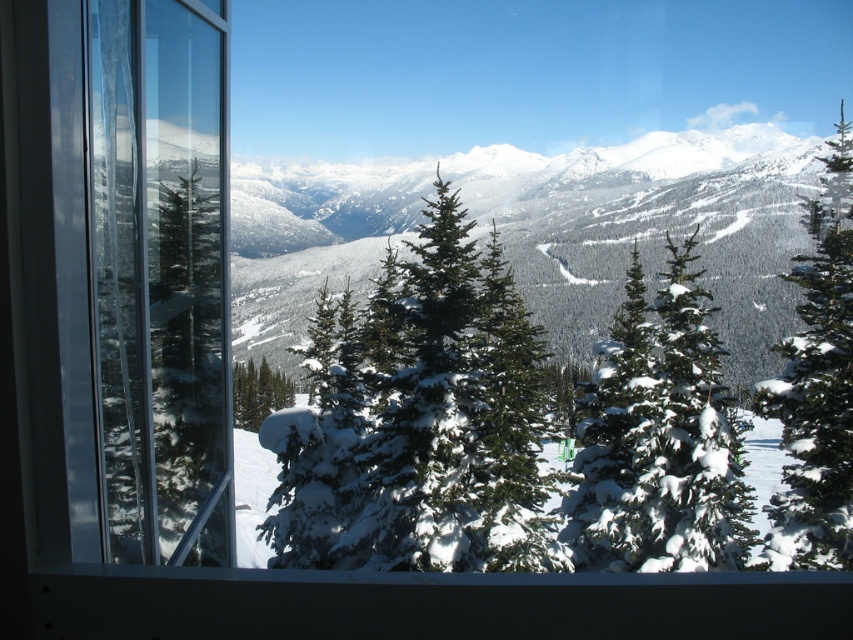
Who is higher up, green textured pine tree at center or green textured pine tree at right?

Positioned higher is green textured pine tree at right.

Is the position of green textured pine tree at center more distant than that of green textured pine tree at right?

No, it is in front of green textured pine tree at right.

Is point (424, 346) closer to camera compared to point (813, 445)?

No, (424, 346) is further to viewer.

The height and width of the screenshot is (640, 853). I want to click on green textured pine tree at center, so click(x=444, y=428).

Does snow-covered evergreen at center have a greater height compared to snow-covered evergreen trees at center?

Yes.

Between snow-covered evergreen at center and snow-covered evergreen trees at center, which one appears on the left side from the viewer's perspective?

Positioned to the left is snow-covered evergreen trees at center.

Where is `snow-covered evergreen at center`? Image resolution: width=853 pixels, height=640 pixels. snow-covered evergreen at center is located at coordinates (660, 440).

At what (x,y) coordinates should I click in order to perform the action: click on snow-covered evergreen at center. Please return your answer as a coordinate pair (x, y). Looking at the image, I should click on (660, 440).

Is green textured pine tree at right above green matte tree at center?

Indeed, green textured pine tree at right is positioned over green matte tree at center.

Is green textured pine tree at right shorter than green matte tree at center?

No.

Does point (820, 461) come behind point (259, 380)?

No, (820, 461) is in front of (259, 380).

Where is `green textured pine tree at right`? This screenshot has height=640, width=853. green textured pine tree at right is located at coordinates click(x=816, y=385).